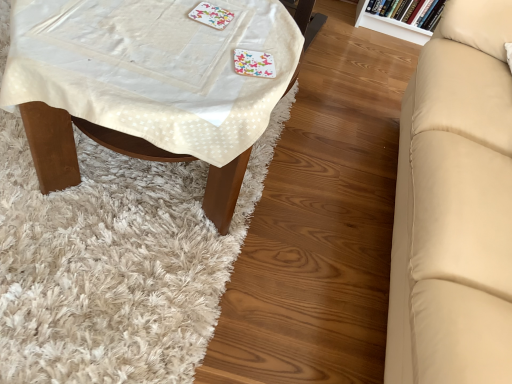
This screenshot has height=384, width=512. I want to click on blank space to the left of beige leather couch at right, so click(318, 193).